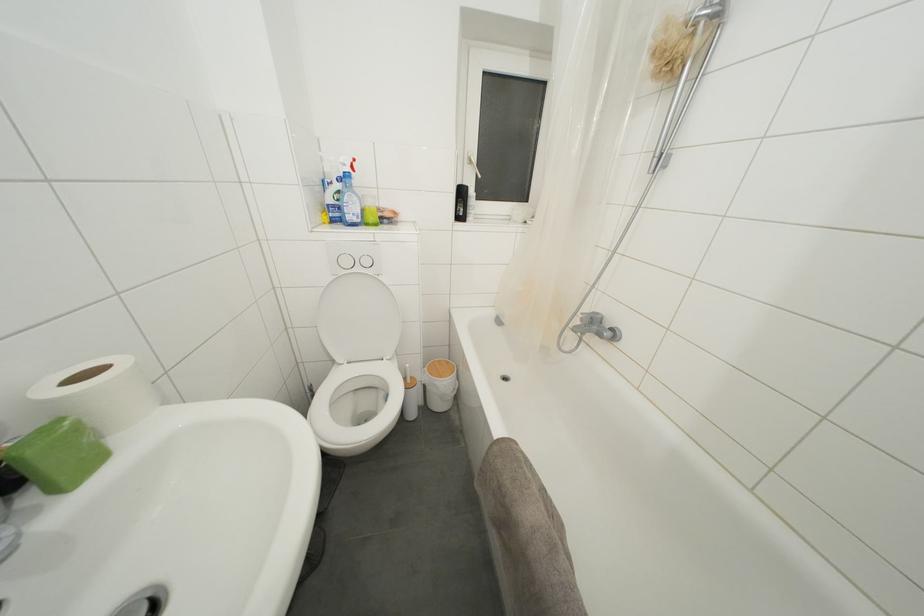
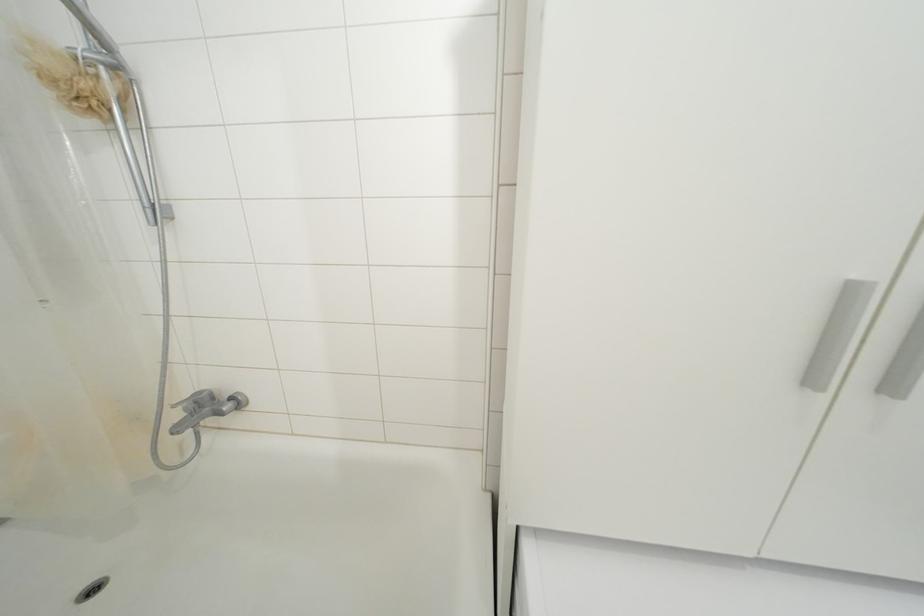
In the second image, find the point that corresponds to pixel 603 321 in the first image.

(209, 398)